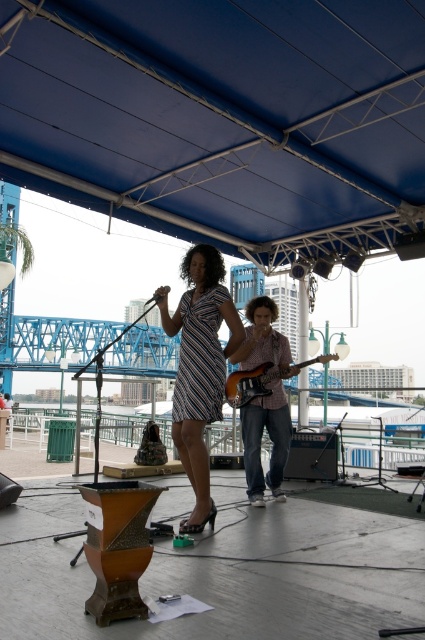
Does striped fabric dress at center appear over wooden electric guitar at center?

Yes.

Measure the distance between striped fabric dress at center and camera.

4.39 meters

Who is more forward, (172, 412) or (266, 380)?

Point (172, 412)

Locate an element on the screen. The width and height of the screenshot is (425, 640). striped fabric dress at center is located at coordinates (198, 368).